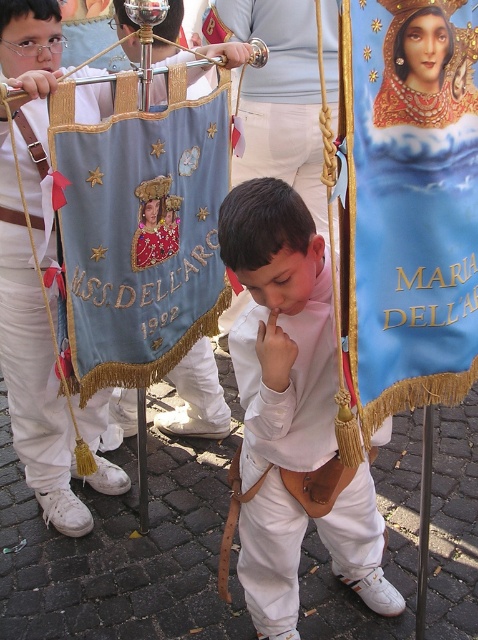
Question: Which object is positioned farthest from the white leather belt at center?

Choices:
 (A) blue fabric banner at center
 (B) light blue fabric banner at left

Answer: (B)

Question: Among these objects, which one is nearest to the camera?

Choices:
 (A) white leather belt at center
 (B) blue fabric banner at center

Answer: (B)

Question: Which object is farther from the camera taking this photo?

Choices:
 (A) light blue fabric banner at left
 (B) white leather belt at center

Answer: (A)

Question: Does blue fabric banner at center appear over white leather belt at center?

Choices:
 (A) no
 (B) yes

Answer: (B)

Question: Does white leather belt at center have a smaller size compared to light blue fabric banner at left?

Choices:
 (A) yes
 (B) no

Answer: (B)

Question: Does blue fabric banner at center appear over white leather belt at center?

Choices:
 (A) no
 (B) yes

Answer: (B)